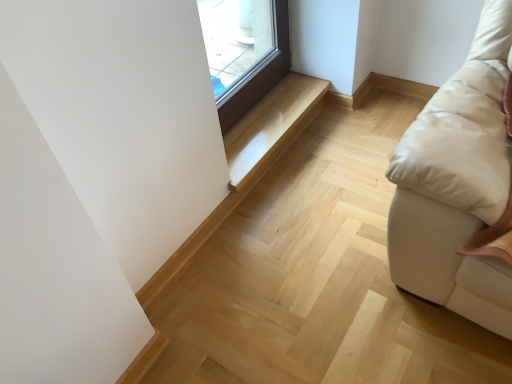
Question: Does point (265, 99) appear closer or farther from the camera than point (163, 271)?

Choices:
 (A) closer
 (B) farther

Answer: (B)

Question: Looking at their shapes, would you say glossy wood bench at center, arranged as the 1th stairwell when viewed from the top, is wider or thinner than light wood stairwell at center, placed as the second stairwell when sorted from top to bottom?

Choices:
 (A) wide
 (B) thin

Answer: (A)

Question: From the image's perspective, relative to light wood stairwell at center, marked as the first stairwell in a bottom-to-top arrangement, is glossy wood bench at center, which appears as the second stairwell when ordered from the bottom, above or below?

Choices:
 (A) above
 (B) below

Answer: (A)

Question: Is point (304, 117) positioned closer to the camera than point (297, 79)?

Choices:
 (A) farther
 (B) closer

Answer: (B)

Question: Is light wood stairwell at center, placed as the second stairwell when sorted from top to bottom, taller or shorter than glossy wood bench at center, arranged as the 1th stairwell when viewed from the top?

Choices:
 (A) tall
 (B) short

Answer: (A)

Question: Would you say light wood stairwell at center, marked as the first stairwell in a bottom-to-top arrangement, is to the left or to the right of glossy wood bench at center, arranged as the 1th stairwell when viewed from the top, in the picture?

Choices:
 (A) left
 (B) right

Answer: (A)

Question: In the image, is light wood stairwell at center, marked as the first stairwell in a bottom-to-top arrangement, positioned in front of or behind glossy wood bench at center, which appears as the second stairwell when ordered from the bottom?

Choices:
 (A) behind
 (B) front

Answer: (B)